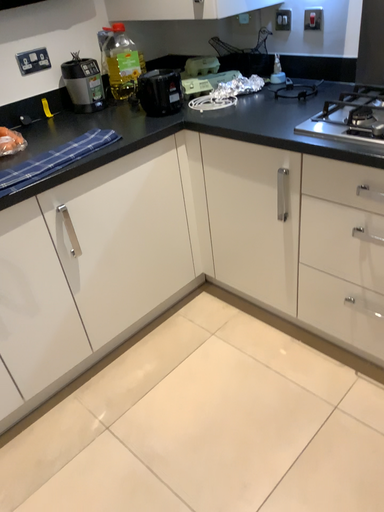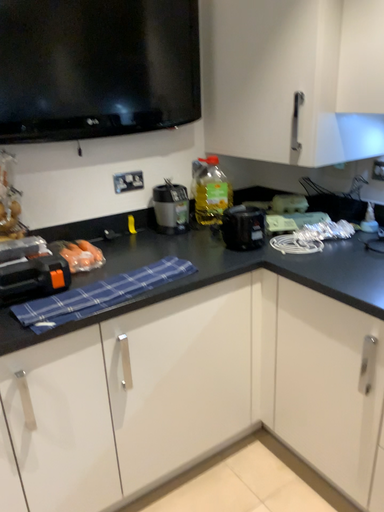
Question: Which way did the camera rotate in the video?

Choices:
 (A) rotated right
 (B) rotated left

Answer: (B)